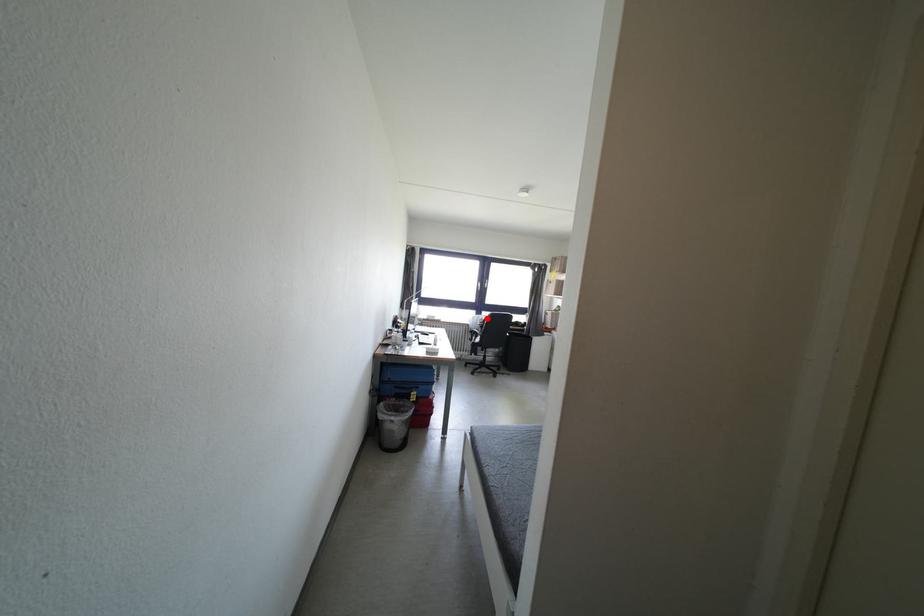
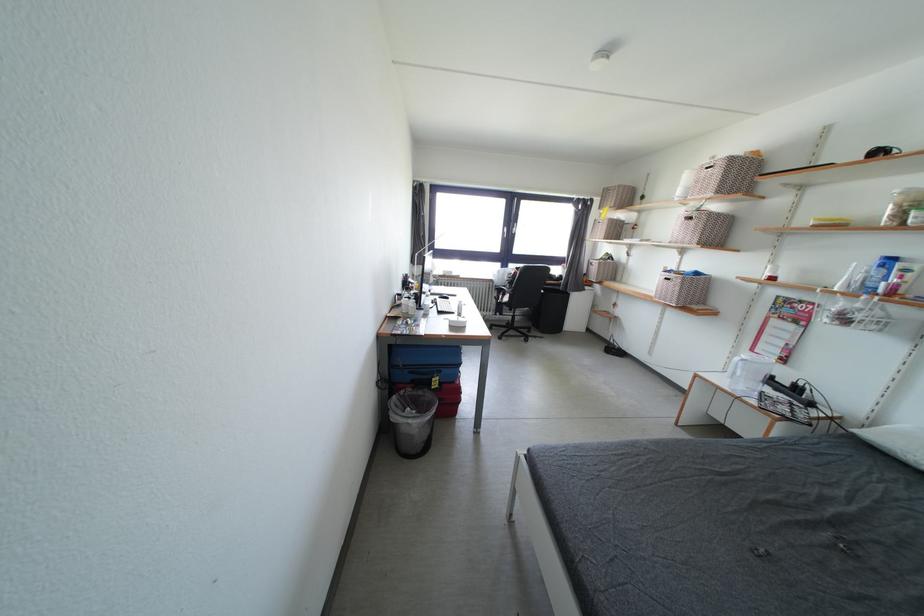
In the second image, find the point that corresponds to the highlighted location in the first image.

(514, 270)